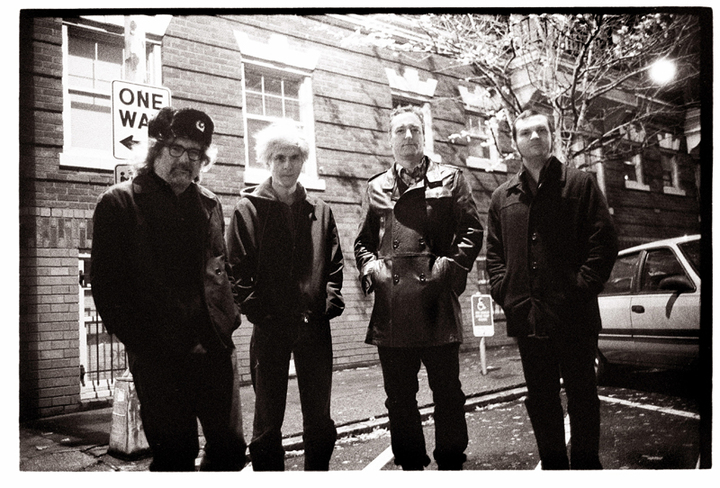
The image size is (720, 488). I want to click on window, so click(x=669, y=170), click(x=629, y=168), click(x=590, y=153), click(x=482, y=144), click(x=399, y=102), click(x=266, y=108), click(x=108, y=87).